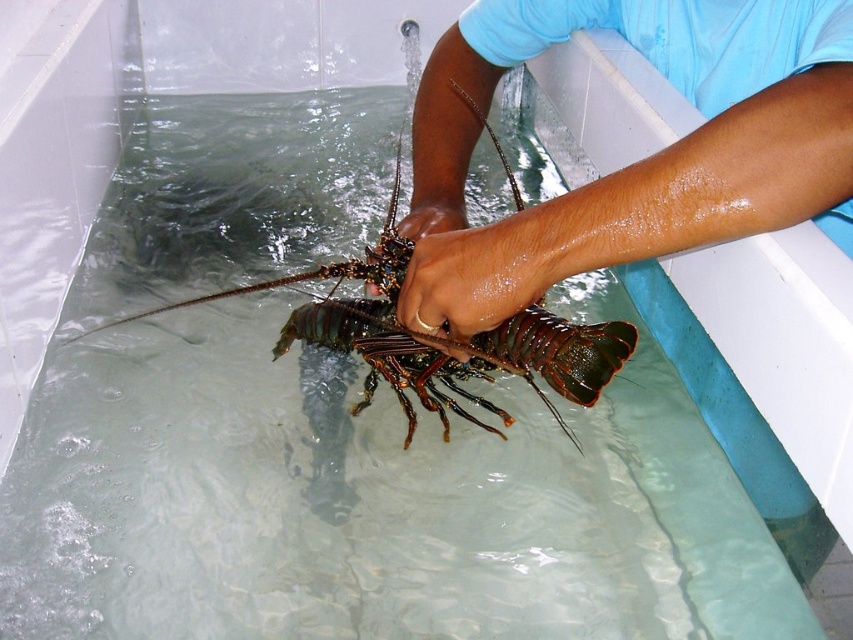
You are a photographer trying to capture the interaction between the smooth skin hands at center and the glossy brown hand at center in the bathtub. Which hand appears taller in the image?

The smooth skin hands at center is taller than glossy brown hand at center.

You are a photographer trying to capture the exact location of point (662, 193) in the image. Based on the scene description, where would this point be located?

The point (662, 193) is located on the smooth skin hands at center.